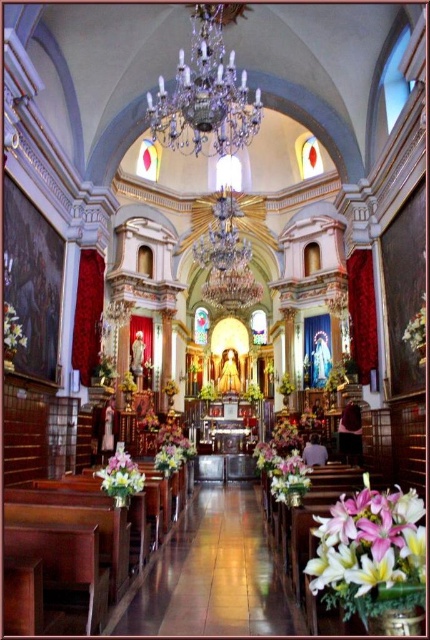
Question: Is pink lily at center further to camera compared to pastel pink silk flowers at lower left?

Choices:
 (A) yes
 (B) no

Answer: (B)

Question: Which point is closer to the camera?

Choices:
 (A) white silk flower at right
 (B) white matte flower at left
 (C) pink lily at center

Answer: (C)

Question: Which of the following is the farthest from the observer?

Choices:
 (A) (129, 480)
 (B) (12, 307)
 (C) (184, 93)

Answer: (C)

Question: Does pink lily at center have a smaller size compared to white floral arrangement at center?

Choices:
 (A) yes
 (B) no

Answer: (A)

Question: Can you confirm if white floral arrangement at center is positioned above white matte flower at left?

Choices:
 (A) no
 (B) yes

Answer: (A)

Question: Which object is the closest to the white floral arrangement at center?

Choices:
 (A) white matte flower at left
 (B) pastel pink silk flowers at lower left
 (C) pink lily at center
 (D) white silk flower at right

Answer: (C)